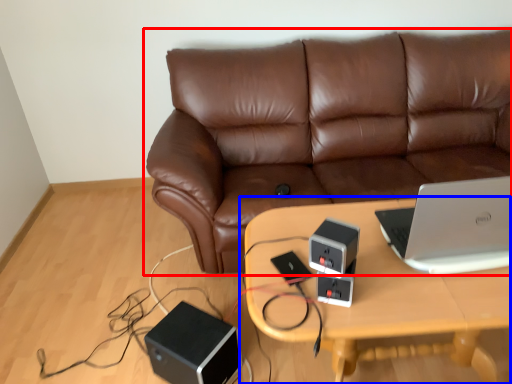
Question: Which point is further to the camera, studio couch (highlighted by a red box) or table (highlighted by a blue box)?

Choices:
 (A) studio couch
 (B) table

Answer: (A)